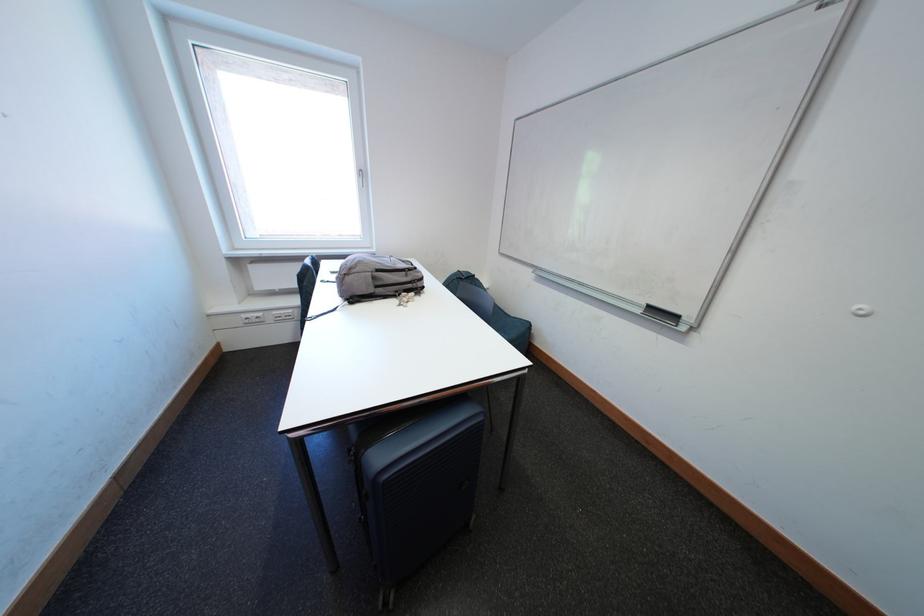
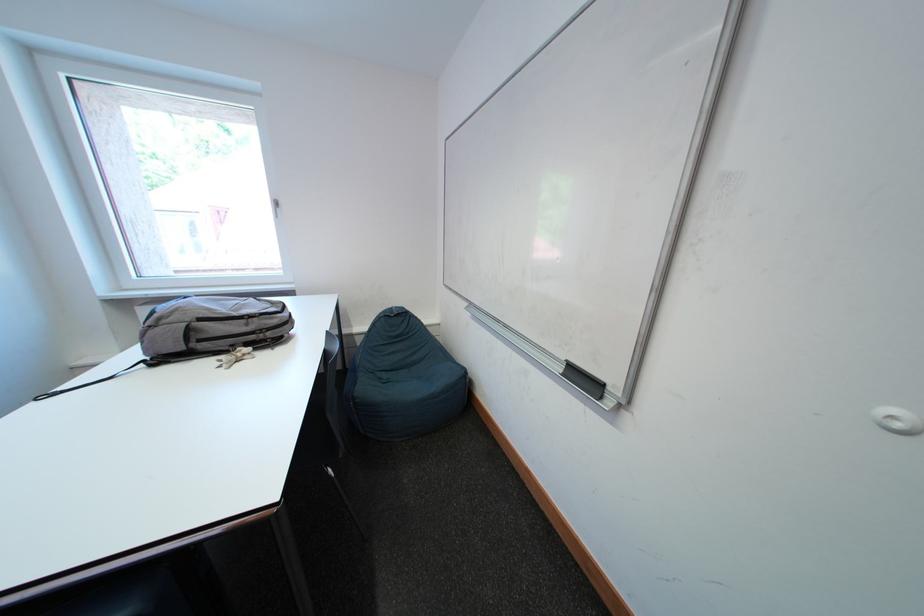
Locate, in the second image, the point that corresponds to [412,277] in the first image.

(252, 325)